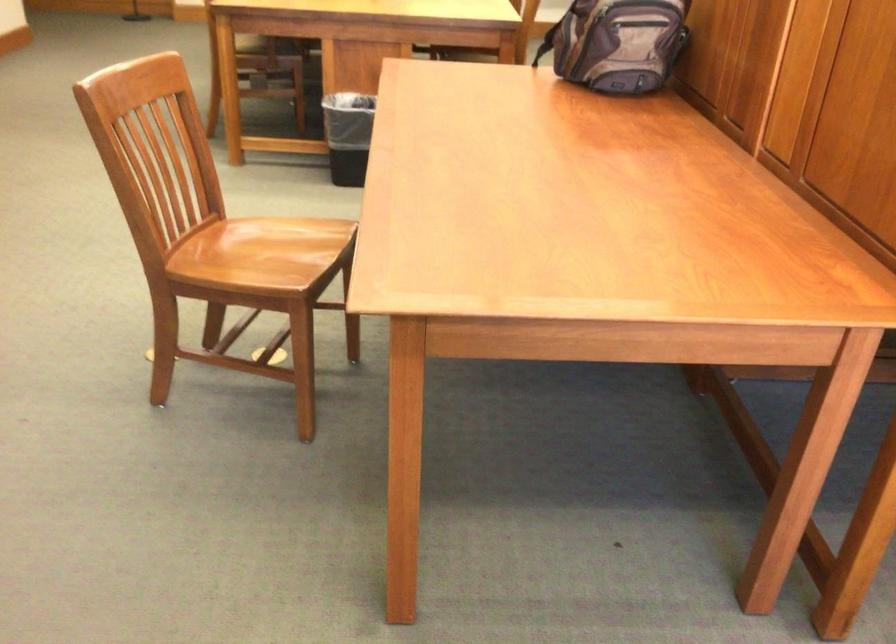
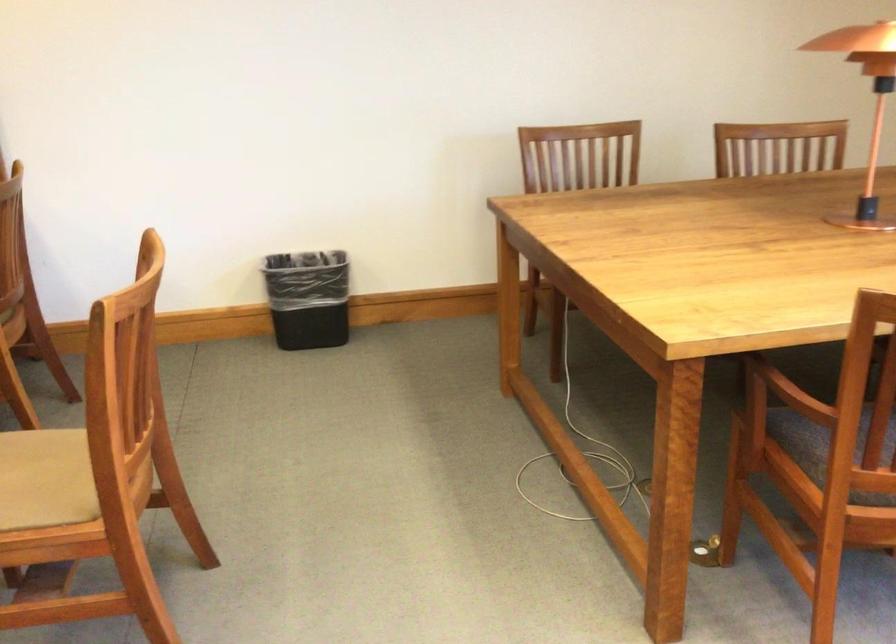
In the scene shown: How did the camera likely rotate?

The rotation direction of the camera is right-down.